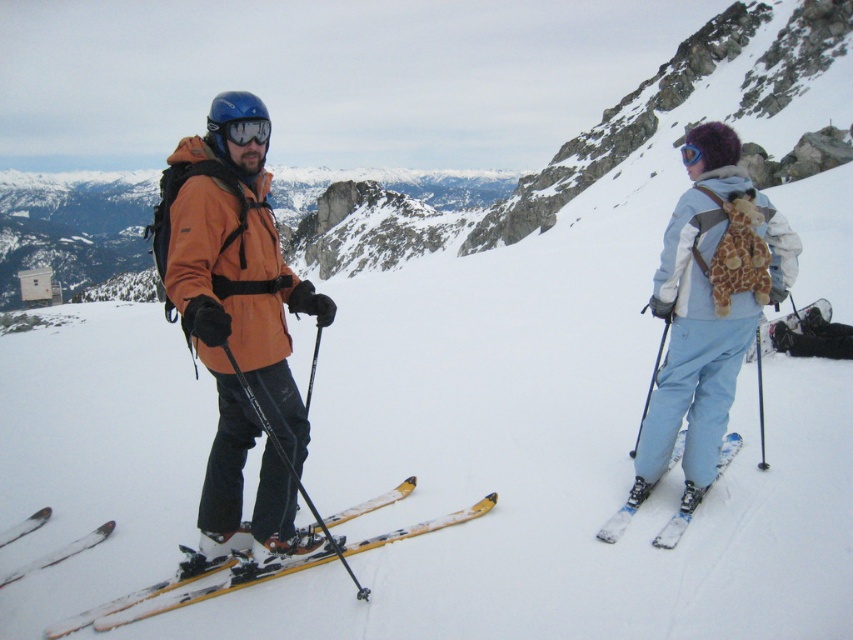
Who is taller, orange softshell jacket at left or blue matte goggles at center?

Standing taller between the two is orange softshell jacket at left.

Between point (722, 435) and point (229, 124), which one is positioned in front?

Point (229, 124) is in front.

Is point (648, 490) closer to viewer compared to point (263, 125)?

No, it is behind (263, 125).

At what (x,y) coordinates should I click in order to perform the action: click on orange softshell jacket at left. Please return your answer as a coordinate pair (x, y). This screenshot has width=853, height=640. Looking at the image, I should click on (706, 310).

Does orange softshell jacket at left appear on the left side of yellow metallic skis at lower left?

Incorrect, orange softshell jacket at left is not on the left side of yellow metallic skis at lower left.

Which is in front, point (207, 540) or point (24, 572)?

Point (24, 572) is in front.

Locate an element on the screen. orange softshell jacket at left is located at coordinates (706, 310).

Does white matte ski at lower right have a larger size compared to yellow metallic skis at lower left?

Correct, white matte ski at lower right is larger in size than yellow metallic skis at lower left.

Between point (683, 528) and point (65, 557), which one is positioned in front?

Point (683, 528) is more forward.

Where is `white matte ski at lower right`? The height and width of the screenshot is (640, 853). white matte ski at lower right is located at coordinates click(616, 524).

The height and width of the screenshot is (640, 853). What are the coordinates of `white matte ski at lower right` in the screenshot? It's located at (616, 524).